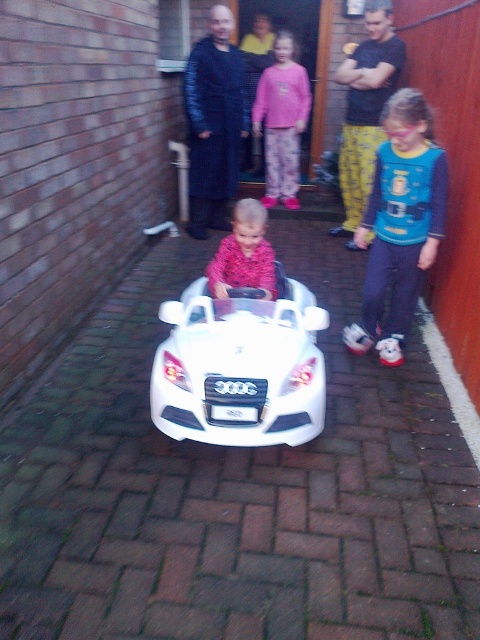
Question: Which of the following is the farthest from the observer?

Choices:
 (A) (217, 296)
 (B) (363, 342)
 (C) (316, 358)
 (D) (276, 172)

Answer: (D)

Question: Which point is farther to the camera?

Choices:
 (A) white plastic car at center
 (B) pink fuzzy sweater at center
 (C) blue fabric shirt at center

Answer: (C)

Question: Is pink fleece sweater at center to the left of pink fuzzy sweater at center from the viewer's perspective?

Choices:
 (A) no
 (B) yes

Answer: (A)

Question: Can you confirm if white plastic car at center is thinner than pink fuzzy sweater at center?

Choices:
 (A) yes
 (B) no

Answer: (B)

Question: Does white plastic car at center have a lesser width compared to pink fleece sweater at center?

Choices:
 (A) no
 (B) yes

Answer: (A)

Question: Based on their relative distances, which object is farther from the pink fleece sweater at center?

Choices:
 (A) white plastic car at center
 (B) pink fuzzy sweater at center

Answer: (A)